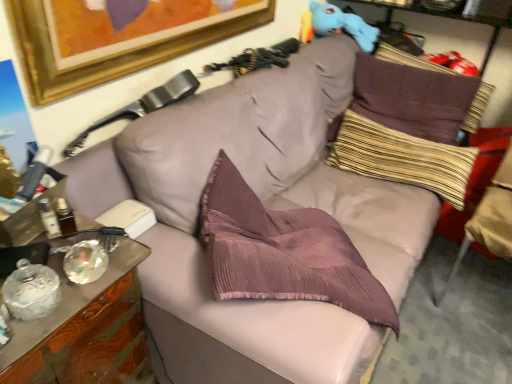
Question: Would you say wooden cabinet at left is outside striped fabric pillow at upper right, which is counted as the 1th pillow, starting from the bottom?

Choices:
 (A) yes
 (B) no

Answer: (A)

Question: Is wooden cabinet at left aimed at striped fabric pillow at upper right, the second pillow viewed from the top?

Choices:
 (A) no
 (B) yes

Answer: (A)

Question: From a real-world perspective, is wooden cabinet at left positioned under striped fabric pillow at upper right, the second pillow viewed from the top, based on gravity?

Choices:
 (A) no
 (B) yes

Answer: (B)

Question: Is wooden cabinet at left to the left of striped fabric pillow at upper right, which is counted as the 1th pillow, starting from the bottom, from the viewer's perspective?

Choices:
 (A) yes
 (B) no

Answer: (A)

Question: Would you say wooden cabinet at left is a long distance from striped fabric pillow at upper right, the second pillow viewed from the top?

Choices:
 (A) no
 (B) yes

Answer: (B)

Question: Considering the relative sizes of wooden cabinet at left and striped fabric pillow at upper right, the second pillow viewed from the top, in the image provided, is wooden cabinet at left taller than striped fabric pillow at upper right, the second pillow viewed from the top,?

Choices:
 (A) yes
 (B) no

Answer: (A)

Question: Is wooden cabinet at left surrounding blue plush toy at upper right?

Choices:
 (A) yes
 (B) no

Answer: (B)

Question: From the image's perspective, would you say wooden cabinet at left is shown under blue plush toy at upper right?

Choices:
 (A) yes
 (B) no

Answer: (A)

Question: Are wooden cabinet at left and blue plush toy at upper right far apart?

Choices:
 (A) no
 (B) yes

Answer: (B)

Question: Is wooden cabinet at left positioned before blue plush toy at upper right?

Choices:
 (A) yes
 (B) no

Answer: (A)

Question: Is wooden cabinet at left positioned with its back to blue plush toy at upper right?

Choices:
 (A) no
 (B) yes

Answer: (A)

Question: Is wooden cabinet at left thinner than blue plush toy at upper right?

Choices:
 (A) no
 (B) yes

Answer: (A)

Question: Is wooden cabinet at left looking in the opposite direction of beige fabric swivel chair at right, placed as the second swivel chair when sorted from left to right?

Choices:
 (A) yes
 (B) no

Answer: (B)